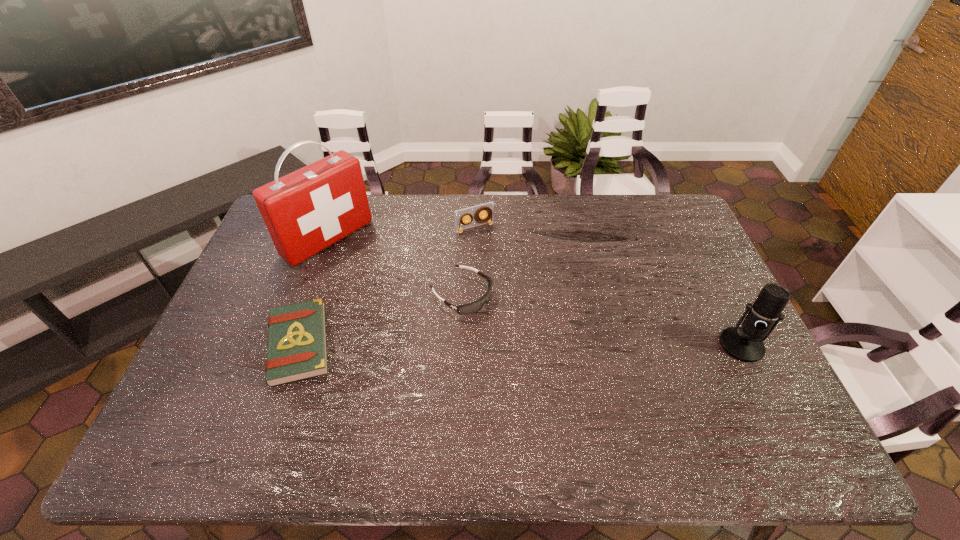
Locate an element on the screen. Image resolution: width=960 pixels, height=540 pixels. the shortest object is located at coordinates (297, 346).

Identify the location of the fourth shortest object. click(745, 343).

Identify the location of the rightmost object. Image resolution: width=960 pixels, height=540 pixels. (745, 343).

You are a GUI agent. You are given a task and a screenshot of the screen. Output one action in this format:
    pyautogui.click(x=<x>, y=<y>)
    Task: Click on the goggles
    
    Given the screenshot: What is the action you would take?
    pyautogui.click(x=465, y=309)

The height and width of the screenshot is (540, 960). I want to click on the tallest object, so click(306, 211).

At what (x,y) coordinates should I click in order to perform the action: click on videotape. Please return your answer as a coordinate pair (x, y). This screenshot has width=960, height=540. Looking at the image, I should click on point(487,209).

Locate an element on the screen. The height and width of the screenshot is (540, 960). vacant space positioned on the right of the shortest object is located at coordinates (428, 344).

Find the location of a particular element. vacant area situated on the back of the rightmost object is located at coordinates (696, 254).

Locate an element on the screen. vacant space located 0.270m on the front and sides of the second shortest object is located at coordinates [x=564, y=359].

Identify the location of vacant point located on the front and sides of the second shortest object. This screenshot has width=960, height=540. (518, 330).